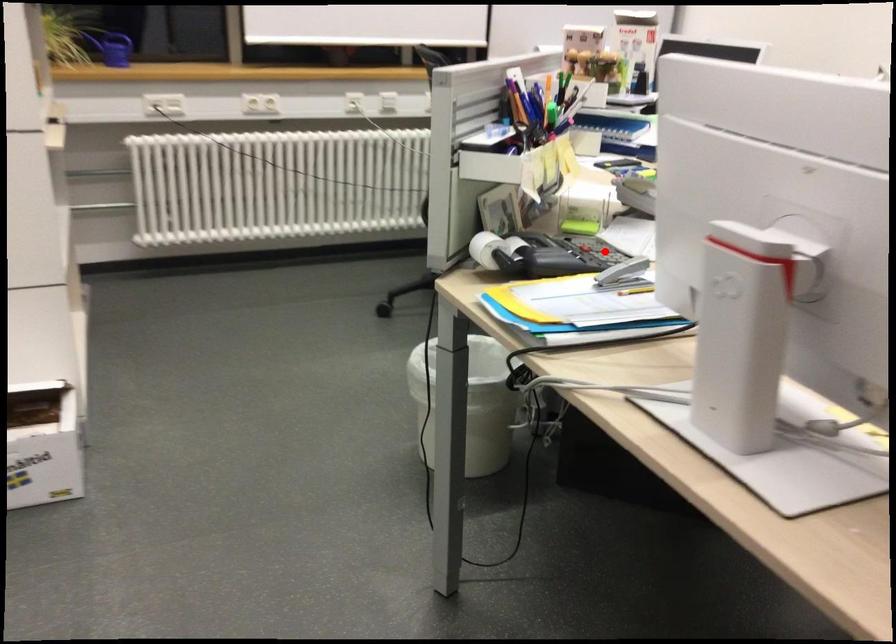
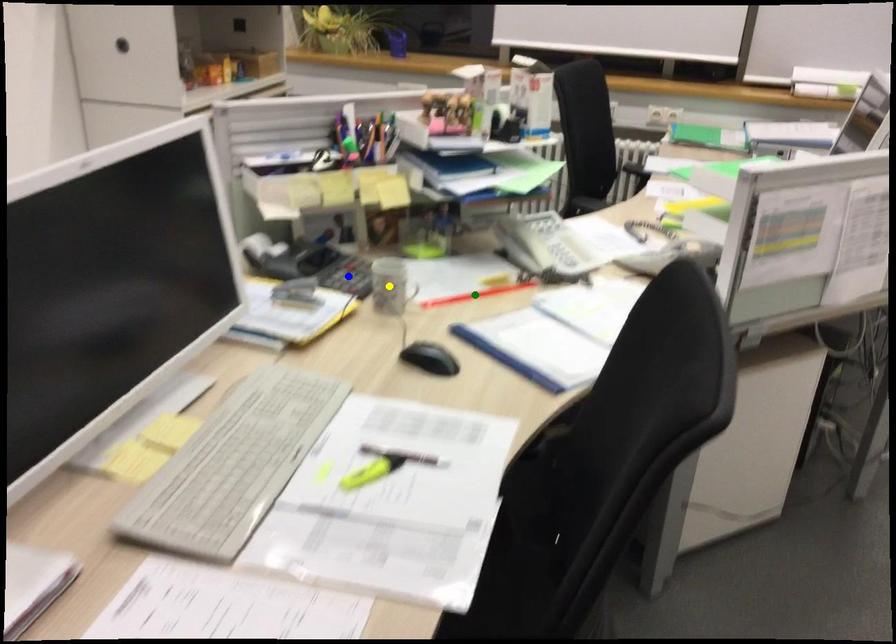
Question: I am providing you with two images of the same scene from different viewpoints. A red point is marked on the first image. You are given multiple points on the second image. Which spot in image 2 lines up with the point in image 1?

Choices:
 (A) blue point
 (B) yellow point
 (C) green point

Answer: (A)